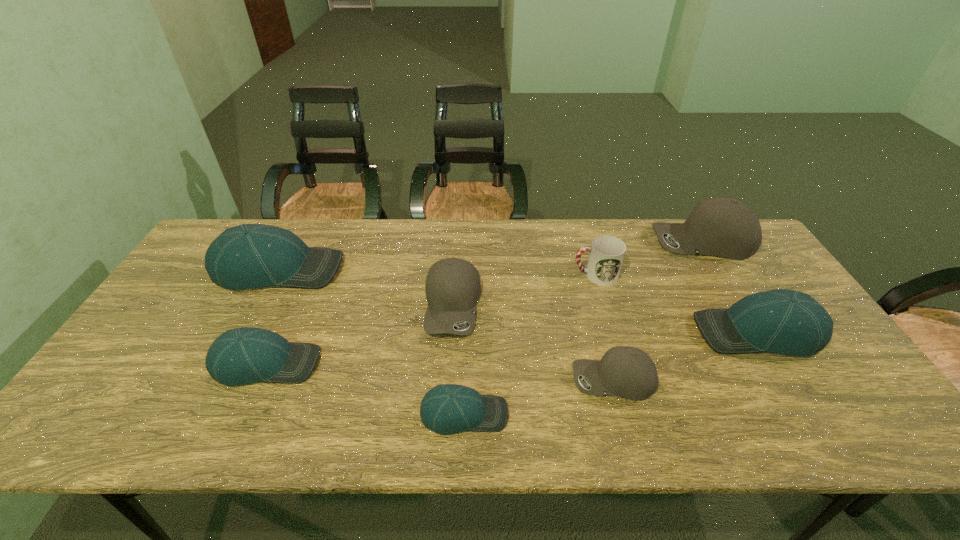
In order to click on unoccupied position between the farthest light baseball cap and the third biggest light baseball cap in this screenshot , I will do `click(273, 316)`.

The width and height of the screenshot is (960, 540). In order to click on vacant region between the third light baseball cap from left to right and the second nearest gray baseball cap in this screenshot , I will do `click(459, 360)`.

The image size is (960, 540). In order to click on free space between the farthest light baseball cap and the shortest baseball cap in this screenshot , I will do `click(372, 341)`.

Select which object appears as the third closest to the biggest light baseball cap. Please provide its 2D coordinates. Your answer should be formatted as a tuple, i.e. [(x, y)], where the tuple contains the x and y coordinates of a point satisfying the conditions above.

[(448, 408)]

Locate which object ranks fifth in proximity to the nearest gray baseball cap. Please provide its 2D coordinates. Your answer should be formatted as a tuple, i.e. [(x, y)], where the tuple contains the x and y coordinates of a point satisfying the conditions above.

[(724, 227)]

Where is `baseball cap that is the third closest to the cup`? The height and width of the screenshot is (540, 960). baseball cap that is the third closest to the cup is located at coordinates (628, 372).

Locate which baseball cap is the fourth closest to the leftmost gray baseball cap. Please provide its 2D coordinates. Your answer should be formatted as a tuple, i.e. [(x, y)], where the tuple contains the x and y coordinates of a point satisfying the conditions above.

[(247, 256)]

Where is `the closest gray baseball cap to the shortest object`? the closest gray baseball cap to the shortest object is located at coordinates (452, 287).

Identify which gray baseball cap is located as the second nearest to the second farthest gray baseball cap. Please provide its 2D coordinates. Your answer should be formatted as a tuple, i.e. [(x, y)], where the tuple contains the x and y coordinates of a point satisfying the conditions above.

[(724, 227)]

Choose which light baseball cap is the second nearest neighbor to the second smallest light baseball cap. Please provide its 2D coordinates. Your answer should be formatted as a tuple, i.e. [(x, y)], where the tuple contains the x and y coordinates of a point satisfying the conditions above.

[(448, 408)]